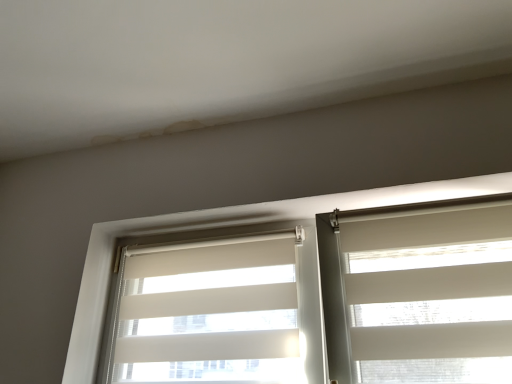
Question: Is point (429, 196) closer or farther from the camera than point (317, 309)?

Choices:
 (A) farther
 (B) closer

Answer: (B)

Question: From a real-world perspective, relative to white fabric window blind at left, the second window blind viewed from the right, is white fabric blinds at center vertically above or below?

Choices:
 (A) below
 (B) above

Answer: (B)

Question: Which of these objects is positioned farthest from the white fabric window blind at right, the second window blind when ordered from left to right?

Choices:
 (A) white fabric window blind at left, placed as the 1th window blind when sorted from left to right
 (B) white fabric blinds at center

Answer: (A)

Question: Based on their relative distances, which object is nearer to the white fabric window blind at right, the first window blind viewed from the right?

Choices:
 (A) white fabric window blind at left, the second window blind viewed from the right
 (B) white fabric blinds at center

Answer: (B)